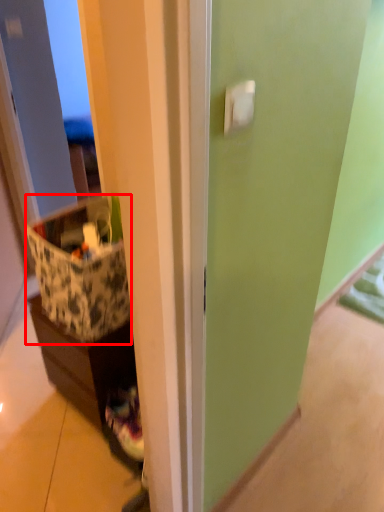
Question: From the image's perspective, what is the correct spatial positioning of storage box (annotated by the red box) in reference to cabinetry?

Choices:
 (A) above
 (B) below

Answer: (A)